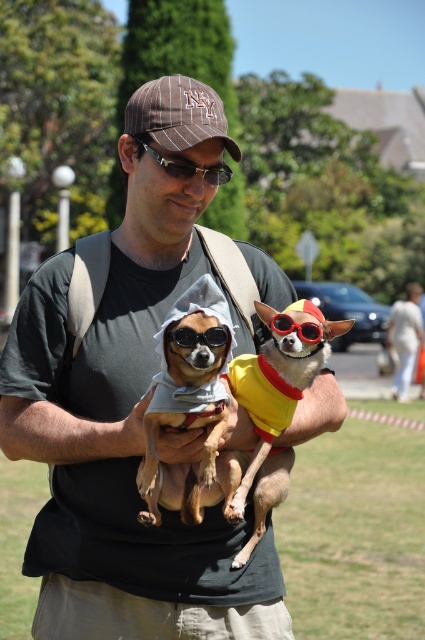
Question: Which point is farther to the camera?

Choices:
 (A) (62, 566)
 (B) (153, 493)
 (C) (192, 173)
 (D) (309, 324)

Answer: (A)

Question: Can you confirm if sunglasses at center is bigger than red plastic goggles at center?

Choices:
 (A) yes
 (B) no

Answer: (B)

Question: Is brown pinstripe baseball cap at center wider than sunglasses at center?

Choices:
 (A) no
 (B) yes

Answer: (B)

Question: Which is nearer to the gray fabric dog at center?

Choices:
 (A) sunglasses at center
 (B) black plastic sunglasses at center
 (C) yellow fabric dog at center

Answer: (A)

Question: Among these points, which one is farthest from the camera?

Choices:
 (A) (232, 172)
 (B) (283, 314)
 (C) (325, 349)

Answer: (A)

Question: Where is matte black t-shirt at center located in relation to black plastic sunglasses at center in the image?

Choices:
 (A) above
 (B) below

Answer: (B)